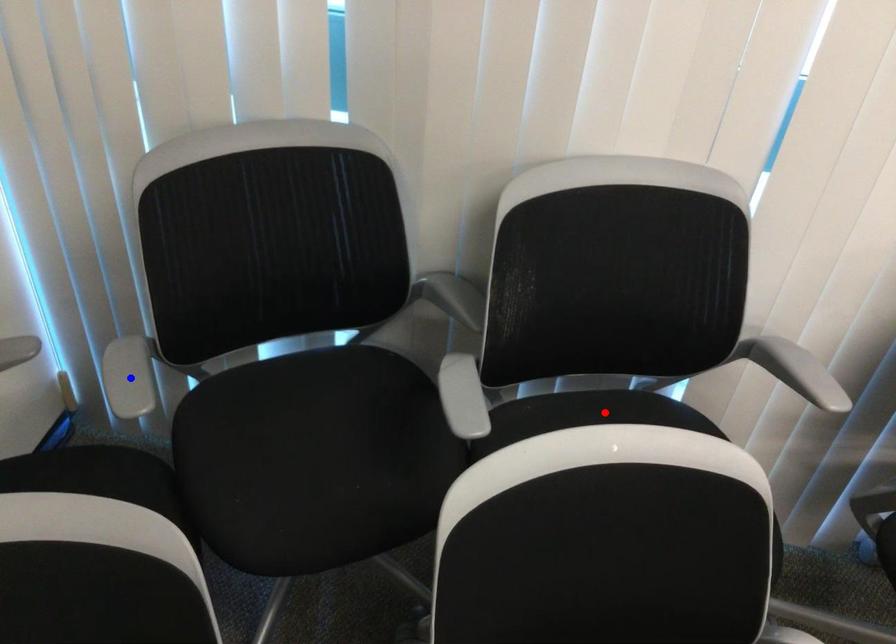
Question: In the image, two points are highlighted. Which point is nearer to the camera? Reply with the corresponding letter.

Choices:
 (A) blue point
 (B) red point

Answer: (A)